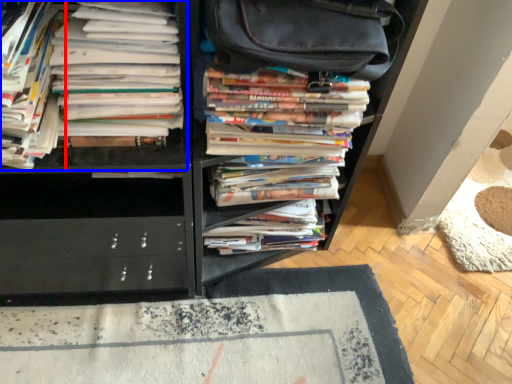
Question: Which point is closer to the camera, book (highlighted by a red box) or book (highlighted by a blue box)?

Choices:
 (A) book
 (B) book

Answer: (A)